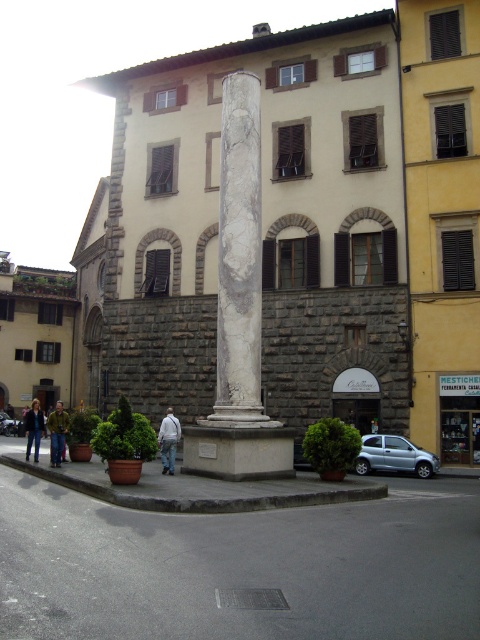
Can you confirm if white marble column at center is smaller than dark blue jacket at lower left?

Yes, white marble column at center is smaller than dark blue jacket at lower left.

Is point (231, 250) behind point (35, 461)?

No, it is not.

Locate an element on the screen. white marble column at center is located at coordinates (239, 310).

Consider the image. Is white cotton jacket at center shorter than green textured jacket at lower left?

Correct, white cotton jacket at center is not as tall as green textured jacket at lower left.

The height and width of the screenshot is (640, 480). Find the location of `white cotton jacket at center`. white cotton jacket at center is located at coordinates (168, 440).

Where is `white cotton jacket at center`? The width and height of the screenshot is (480, 640). white cotton jacket at center is located at coordinates (168, 440).

Does white marble column at center have a greater width compared to white cotton jacket at center?

Correct, the width of white marble column at center exceeds that of white cotton jacket at center.

Who is shorter, white marble column at center or white cotton jacket at center?

Standing shorter between the two is white cotton jacket at center.

Where is `white marble column at center`? This screenshot has width=480, height=640. white marble column at center is located at coordinates (239, 310).

Locate an element on the screen. The width and height of the screenshot is (480, 640). white marble column at center is located at coordinates (239, 310).